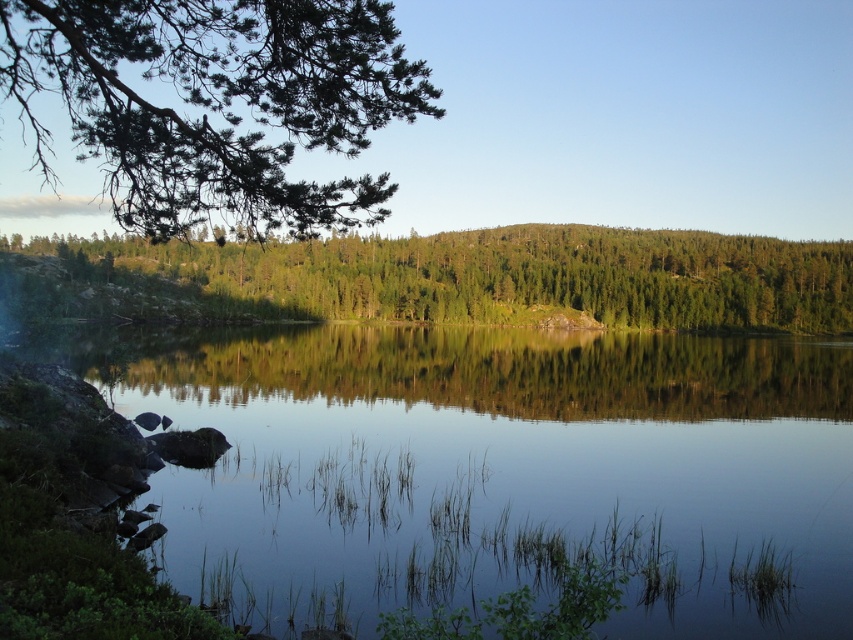
Between green needle-like branches at upper left and green matte tree at center, which one has less height?

Standing shorter between the two is green matte tree at center.

Which is above, green needle-like branches at upper left or green matte tree at center?

green needle-like branches at upper left is higher up.

Image resolution: width=853 pixels, height=640 pixels. In order to click on green needle-like branches at upper left in this screenshot , I will do `click(216, 104)`.

Identify the location of green needle-like branches at upper left. The width and height of the screenshot is (853, 640). (216, 104).

Is clear water at center wider than green matte tree at center?

Incorrect, clear water at center's width does not surpass green matte tree at center's.

Does clear water at center have a smaller size compared to green matte tree at center?

Correct, clear water at center occupies less space than green matte tree at center.

Does point (553, 440) lie behind point (804, 328)?

No, it is in front of (804, 328).

Where is `clear water at center`? clear water at center is located at coordinates (495, 470).

Does clear water at center have a lesser height compared to green needle-like branches at upper left?

Correct, clear water at center is not as tall as green needle-like branches at upper left.

Which is below, clear water at center or green needle-like branches at upper left?

clear water at center is below.

Is point (563, 474) farther from camera compared to point (332, 22)?

Yes, point (563, 474) is behind point (332, 22).

The image size is (853, 640). I want to click on clear water at center, so click(495, 470).